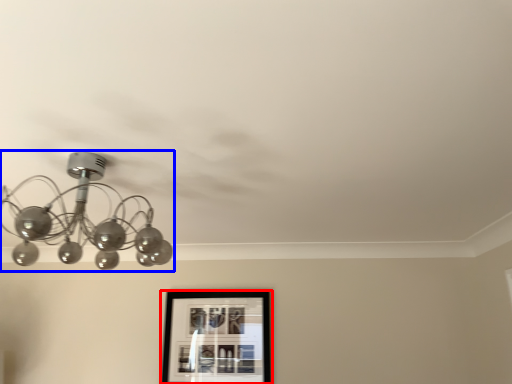
Question: Which object is further to the camera taking this photo, picture frame (highlighted by a red box) or lamp (highlighted by a blue box)?

Choices:
 (A) picture frame
 (B) lamp

Answer: (A)